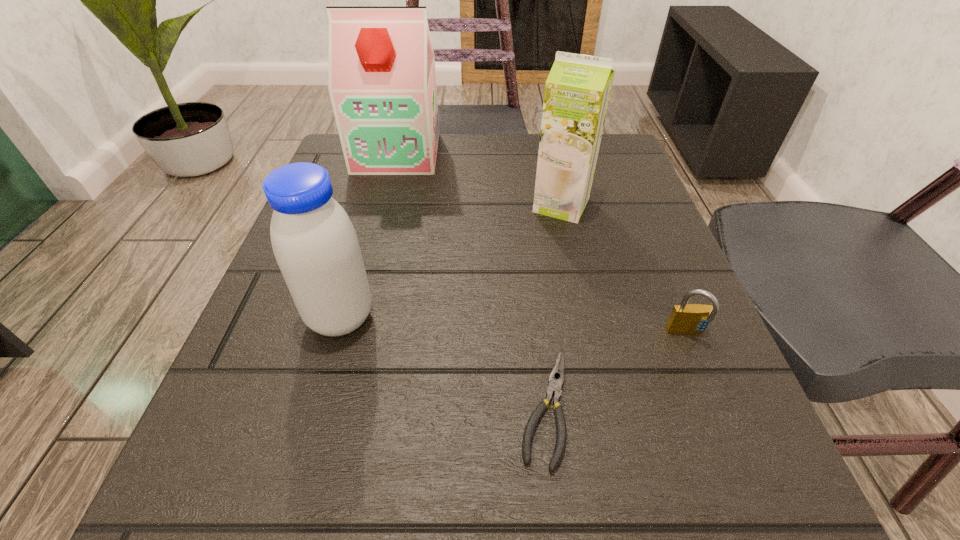
Locate an element on the screen. The image size is (960, 540). vacant space in between the padlock and the rightmost soya milk is located at coordinates (624, 269).

In order to click on unoccupied area between the farthest object and the nearest soya milk in this screenshot , I will do `click(369, 235)`.

Locate an element on the screen. empty location between the shortest object and the nearest soya milk is located at coordinates 443,362.

Select which object is the third closest to the shortest object. Please provide its 2D coordinates. Your answer should be formatted as a tuple, i.e. [(x, y)], where the tuple contains the x and y coordinates of a point satisfying the conditions above.

[(577, 90)]

This screenshot has height=540, width=960. I want to click on object that stands as the second closest to the pliers, so click(x=314, y=242).

Select which soya milk is the third closest to the fourth tallest object. Please provide its 2D coordinates. Your answer should be formatted as a tuple, i.e. [(x, y)], where the tuple contains the x and y coordinates of a point satisfying the conditions above.

[(382, 83)]

In order to click on the second closest soya milk to the nearest object in this screenshot , I will do [577, 90].

Identify the location of free spot that satisfies the following two spatial constraints: 1. on the front side of the shortest object; 2. on the right side of the nearest soya milk. (316, 407).

The height and width of the screenshot is (540, 960). In order to click on vacant space that satisfies the following two spatial constraints: 1. with the cap open on the fourth nearest object; 2. on the right side of the farthest object in this screenshot , I will do `click(383, 205)`.